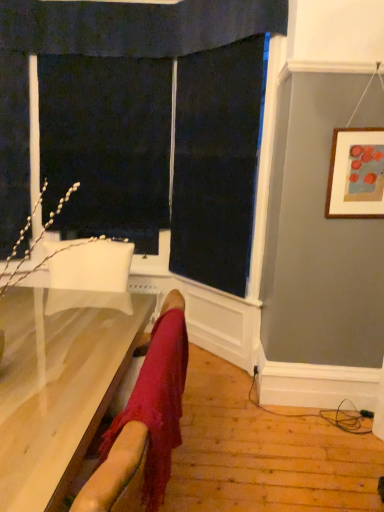
Question: Should I look upward or downward to see light wood table at lower left?

Choices:
 (A) up
 (B) down

Answer: (B)

Question: Is light wood table at lower left wider than wooden framed artwork at upper right?

Choices:
 (A) no
 (B) yes

Answer: (B)

Question: Is light wood table at lower left not inside wooden framed artwork at upper right?

Choices:
 (A) yes
 (B) no

Answer: (A)

Question: Would you say wooden framed artwork at upper right is part of light wood table at lower left's contents?

Choices:
 (A) yes
 (B) no

Answer: (B)

Question: Can you confirm if light wood table at lower left is taller than wooden framed artwork at upper right?

Choices:
 (A) yes
 (B) no

Answer: (A)

Question: Are light wood table at lower left and wooden framed artwork at upper right far apart?

Choices:
 (A) yes
 (B) no

Answer: (A)

Question: Could you tell me if light wood table at lower left is facing wooden framed artwork at upper right?

Choices:
 (A) yes
 (B) no

Answer: (B)

Question: From a real-world perspective, is wooden framed artwork at upper right physically below light wood table at lower left?

Choices:
 (A) no
 (B) yes

Answer: (A)

Question: Is wooden framed artwork at upper right at the right side of light wood table at lower left?

Choices:
 (A) no
 (B) yes

Answer: (B)

Question: From a real-world perspective, is wooden framed artwork at upper right on top of light wood table at lower left?

Choices:
 (A) no
 (B) yes

Answer: (B)

Question: Is wooden framed artwork at upper right completely or partially outside of light wood table at lower left?

Choices:
 (A) yes
 (B) no

Answer: (A)

Question: Is wooden framed artwork at upper right placed right next to light wood table at lower left?

Choices:
 (A) yes
 (B) no

Answer: (B)

Question: From the image's perspective, would you say wooden framed artwork at upper right is shown under light wood table at lower left?

Choices:
 (A) no
 (B) yes

Answer: (A)

Question: Would you say black fabric screen door at upper left contains light wood table at lower left?

Choices:
 (A) no
 (B) yes

Answer: (A)